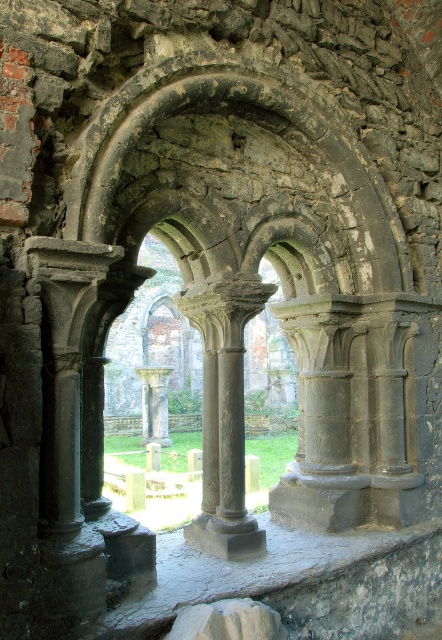
Question: Is smooth gray stone column at center smaller than gray stone column at center?

Choices:
 (A) yes
 (B) no

Answer: (A)

Question: Is smooth gray stone column at center thinner than gray stone column at center?

Choices:
 (A) yes
 (B) no

Answer: (A)

Question: Among these points, which one is farthest from the camera?

Choices:
 (A) (x=159, y=413)
 (B) (x=243, y=312)

Answer: (A)

Question: In this image, where is smooth gray stone column at center located relative to gray stone column at center?

Choices:
 (A) left
 (B) right

Answer: (B)

Question: Which point is closer to the camera taking this photo?

Choices:
 (A) (195, 294)
 (B) (162, 416)

Answer: (A)